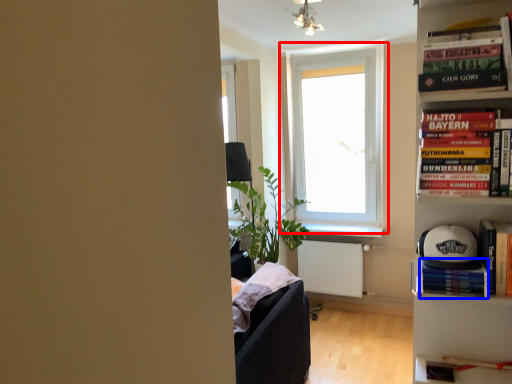
Question: Which point is closer to the camera, window (highlighted by a red box) or paperback book (highlighted by a blue box)?

Choices:
 (A) window
 (B) paperback book

Answer: (B)